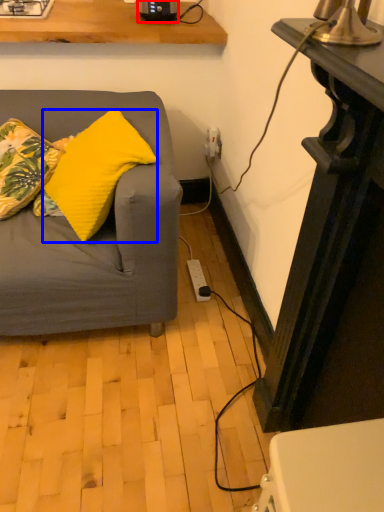
Question: Which object is closer to the camera taking this photo, appliance (highlighted by a red box) or pillow (highlighted by a blue box)?

Choices:
 (A) appliance
 (B) pillow

Answer: (B)